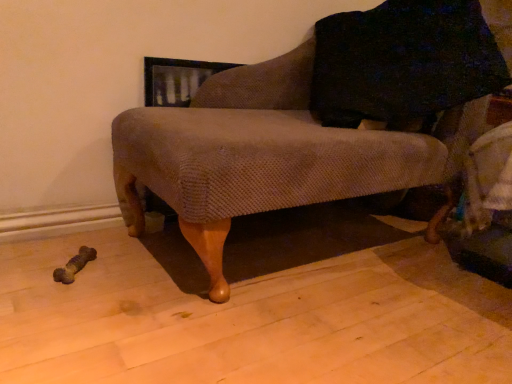
Question: Should I look upward or downward to see knitted fabric chair at center?

Choices:
 (A) up
 (B) down

Answer: (A)